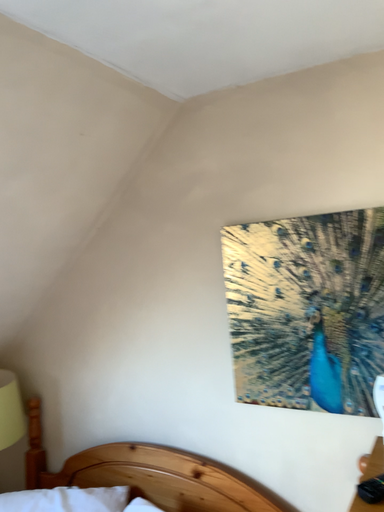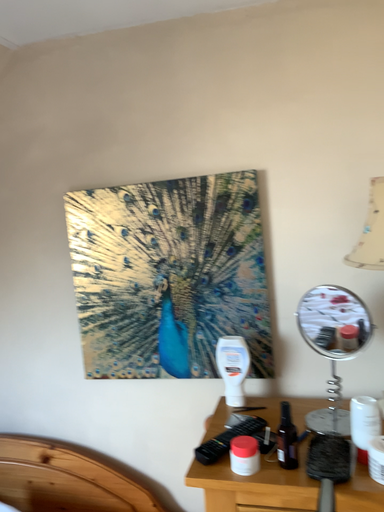
Question: Which way did the camera rotate in the video?

Choices:
 (A) rotated right
 (B) rotated left

Answer: (A)